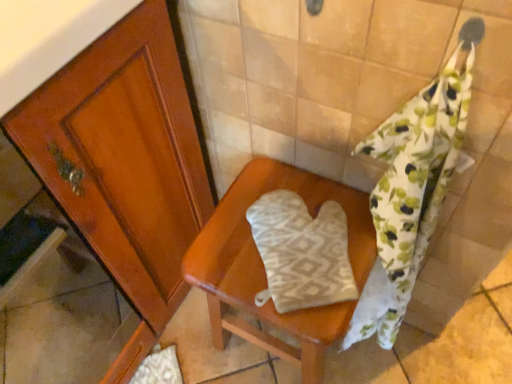
Question: Is point (237, 213) closer or farther from the camera than point (470, 41)?

Choices:
 (A) farther
 (B) closer

Answer: (A)

Question: Based on their sizes in the image, would you say beige fabric oven mitt at center is bigger or smaller than floral cotton towel at right?

Choices:
 (A) small
 (B) big

Answer: (B)

Question: Estimate the real-world distances between objects in this image. Which object is closer to the floral cotton towel at right?

Choices:
 (A) beige fabric oven mitt at center
 (B) white textured oven mitt at center

Answer: (B)

Question: Estimate the real-world distances between objects in this image. Which object is farther from the beige fabric oven mitt at center?

Choices:
 (A) white textured oven mitt at center
 (B) floral cotton towel at right

Answer: (B)